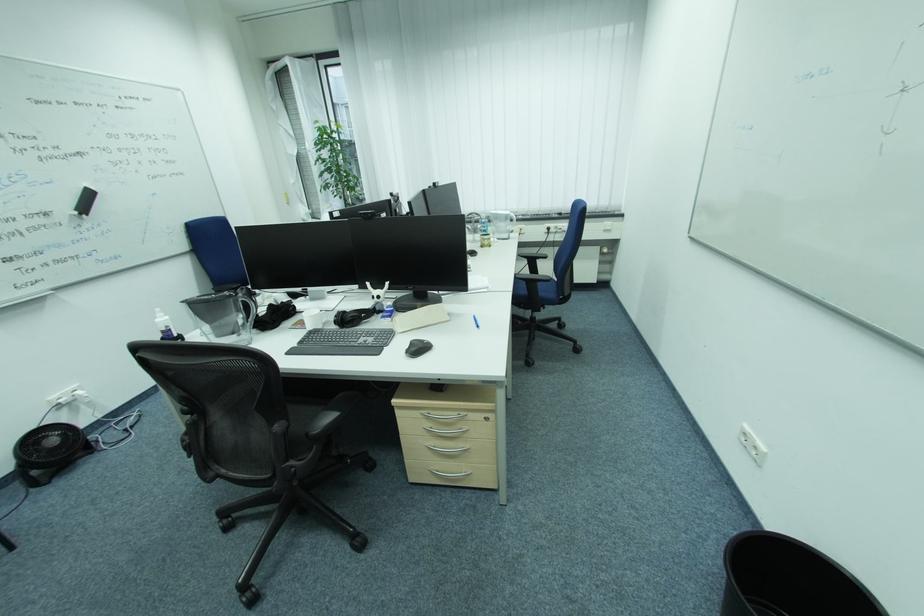
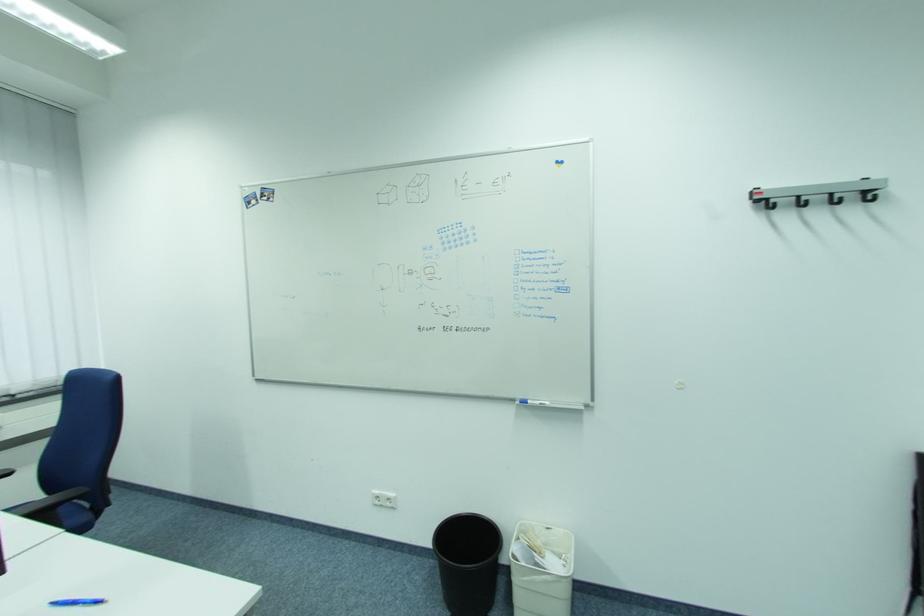
The point at (x=762, y=448) is marked in the first image. Where is the corresponding point in the second image?

(395, 500)